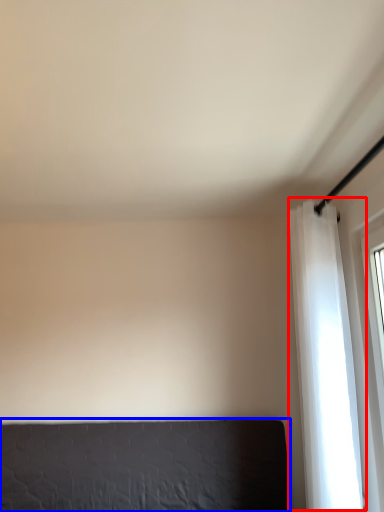
Question: Which of the following is the closest to the observer, curtain (highlighted by a red box) or furniture (highlighted by a blue box)?

Choices:
 (A) curtain
 (B) furniture

Answer: (A)